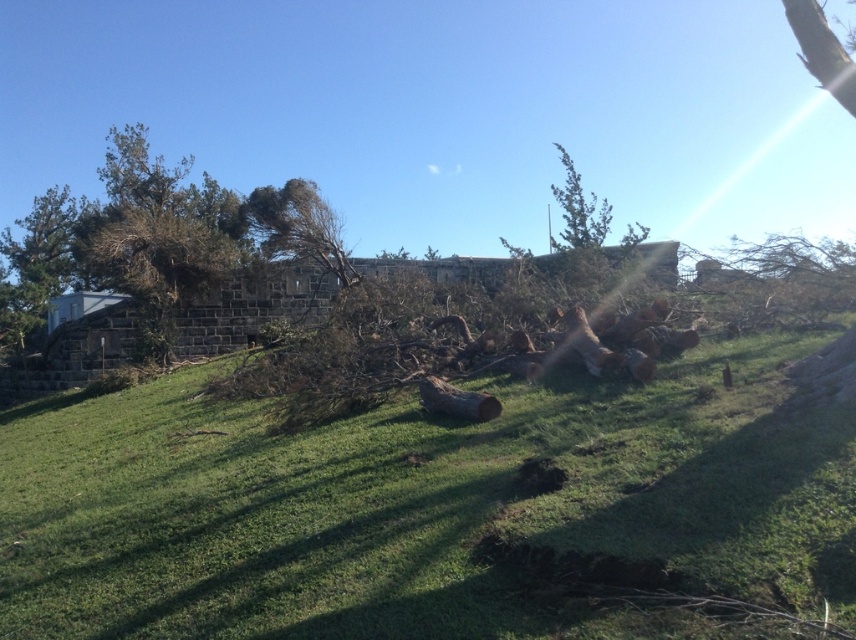
Describe the element at coordinates (159, 234) in the screenshot. I see `green leafy tree at upper left` at that location.

Find the location of a particular element. Image resolution: width=856 pixels, height=640 pixels. green leafy tree at upper left is located at coordinates (159, 234).

Looking at this image, between green grassy at center and green leafy tree at upper center, which one has less height?

With less height is green grassy at center.

Is point (272, 528) less distant than point (572, 218)?

Yes, it is in front of point (572, 218).

Image resolution: width=856 pixels, height=640 pixels. I want to click on green grassy at center, so click(x=426, y=509).

Is green grassy at center below green leafy tree at upper left?

Yes, green grassy at center is below green leafy tree at upper left.

Who is more forward, (586,541) or (227,196)?

Point (586,541)

Where is `green grassy at center`? The image size is (856, 640). green grassy at center is located at coordinates (426, 509).